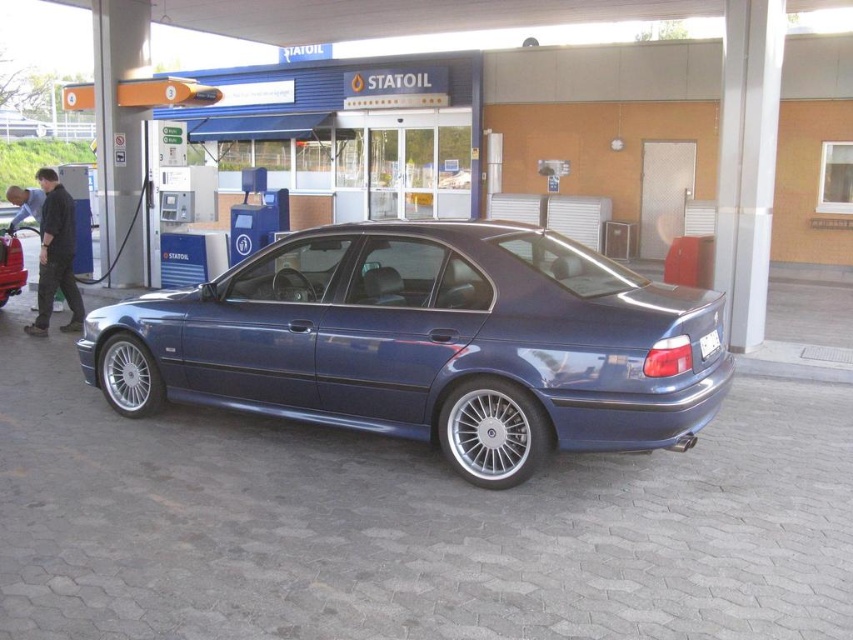
Which is in front, point (3, 275) or point (711, 337)?

Point (711, 337) is in front.

Can you confirm if matte blue sedan at center is bigger than white plastic license plate at rear?

Correct, matte blue sedan at center is larger in size than white plastic license plate at rear.

Is point (18, 257) closer to viewer compared to point (718, 333)?

No, (18, 257) is further to viewer.

I want to click on matte blue sedan at center, so click(10, 268).

Between metallic blue sedan at center and matte blue sedan at center, which one is positioned lower?

metallic blue sedan at center is lower down.

Is metallic blue sedan at center smaller than matte blue sedan at center?

No, metallic blue sedan at center is not smaller than matte blue sedan at center.

Is point (321, 417) positioned after point (24, 269)?

No, it is not.

Where is `metallic blue sedan at center`? Image resolution: width=853 pixels, height=640 pixels. metallic blue sedan at center is located at coordinates (428, 342).

Between metallic blue sedan at center and white plastic license plate at rear, which one appears on the left side from the viewer's perspective?

Positioned to the left is metallic blue sedan at center.

Between point (335, 301) and point (705, 342), which one is positioned in front?

Point (705, 342)

Is point (699, 381) positioned behind point (699, 344)?

No, (699, 381) is closer to viewer.

Locate an element on the screen. metallic blue sedan at center is located at coordinates (428, 342).